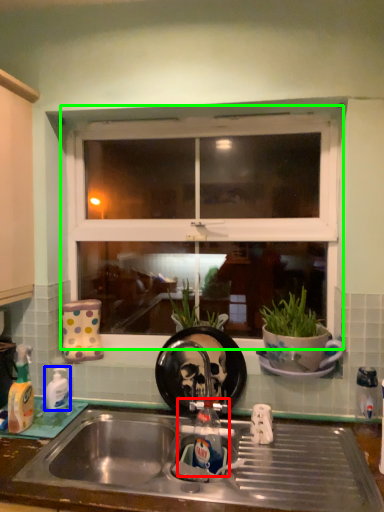
Question: Which object is the closest to the tap (highlighted by a red box)? Choose among these: bottle (highlighted by a blue box) or window (highlighted by a green box).

Choices:
 (A) bottle
 (B) window

Answer: (A)